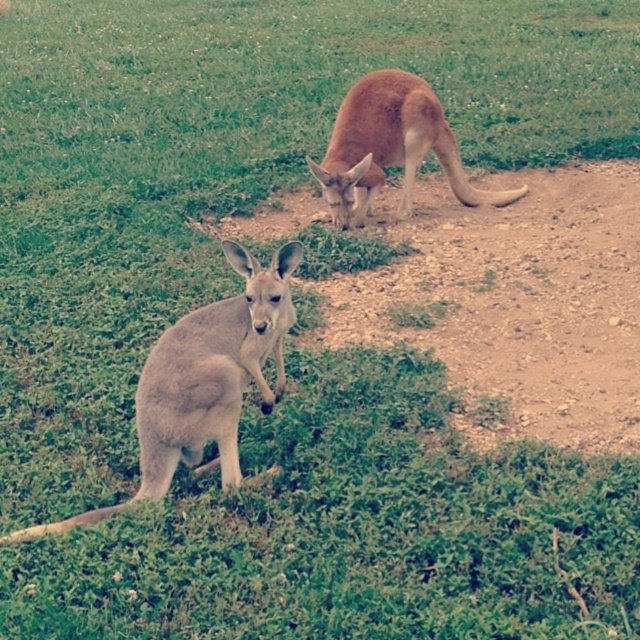
You are a photographer trying to capture both kangaroos in a single shot. Given their positions, can you position yourself so that the light brown fur kangaroo at lower left is not blocking the view of the brown fur kangaroo at upper center?

The light brown fur kangaroo at lower left is positioned under the brown fur kangaroo at upper center, so if you position yourself appropriately, you can angle your camera upwards to ensure the lower kangaroo does not block the view of the upper one.

You are a photographer trying to capture both the light brown fur kangaroo at lower left and the brown fur kangaroo at upper center in a single frame. Based on their positions, which kangaroo should you adjust your camera angle to focus on first to ensure both are in the shot?

The light brown fur kangaroo at lower left is positioned on the left side of the brown fur kangaroo at upper center, so you should focus on the light brown fur kangaroo at lower left first to ensure both are in the frame.